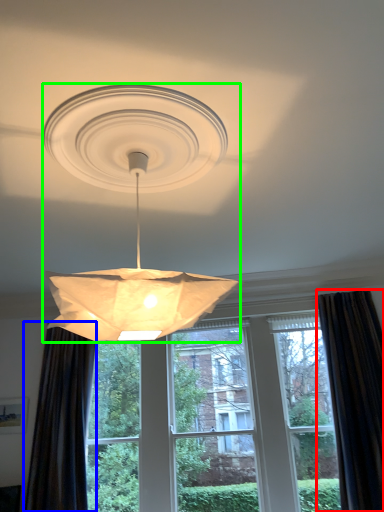
Question: Which is farther away from curtain (highlighted by a red box)? curtain (highlighted by a blue box) or lamp (highlighted by a green box)?

Choices:
 (A) curtain
 (B) lamp

Answer: (B)